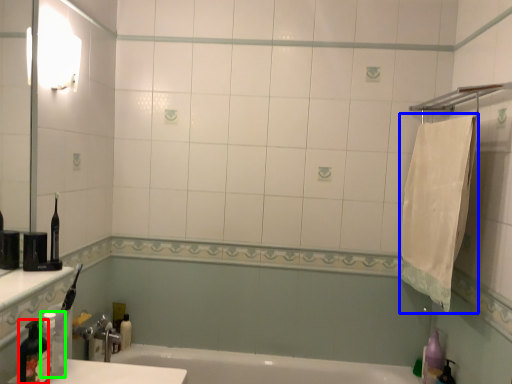
Question: Estimate the real-world distances between objects in this image. Which object is closer to bottle (highlighted by a red box), bath towel (highlighted by a blue box) or bottle (highlighted by a green box)?

Choices:
 (A) bath towel
 (B) bottle

Answer: (B)